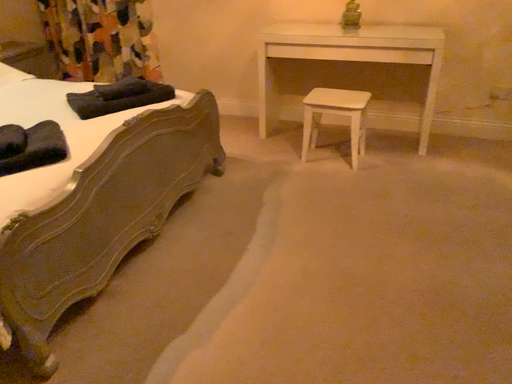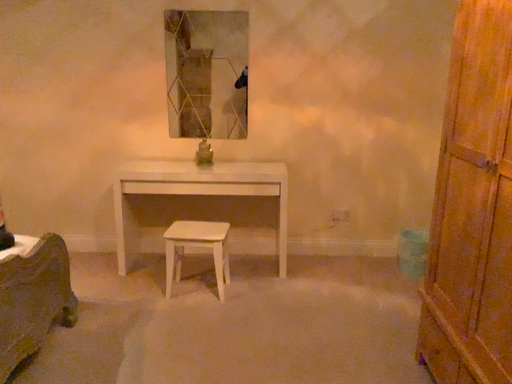
Question: How did the camera likely rotate when shooting the video?

Choices:
 (A) rotated downward
 (B) rotated upward

Answer: (B)